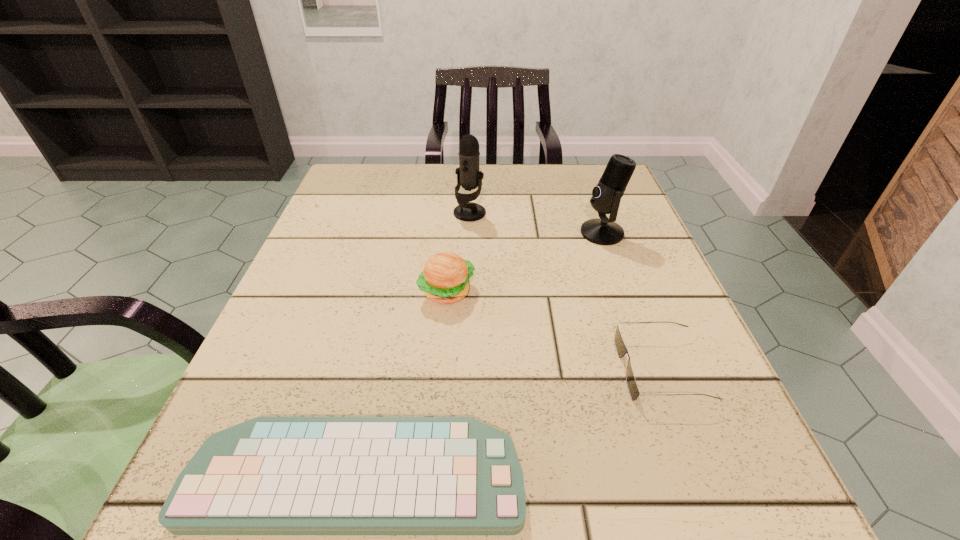
Locate which object ranks third in proximity to the right microphone. Please provide its 2D coordinates. Your answer should be formatted as a tuple, i.e. [(x, y)], where the tuple contains the x and y coordinates of a point satisfying the conditions above.

[(621, 349)]